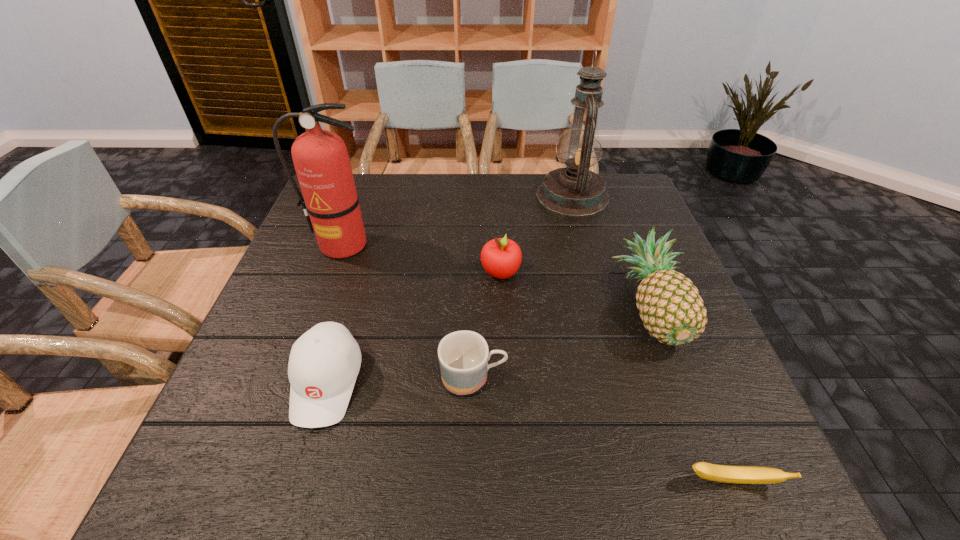
Find the location of `banana that is positioned at the right edge`. banana that is positioned at the right edge is located at coordinates (721, 473).

Identify the location of object that is positioned at the far right corner. This screenshot has height=540, width=960. (575, 191).

Locate an element on the screen. This screenshot has width=960, height=540. object that is at the near right corner is located at coordinates (721, 473).

The width and height of the screenshot is (960, 540). Identify the location of vacant space at the far edge of the desktop. (406, 179).

Find the location of `free space at the near edge of the desktop`. free space at the near edge of the desktop is located at coordinates (540, 496).

This screenshot has width=960, height=540. What are the coordinates of `free point at the left edge` in the screenshot? It's located at (238, 407).

The image size is (960, 540). I want to click on free space at the near left corner, so click(x=220, y=460).

Find the location of `free region at the near right corner of the desktop`. free region at the near right corner of the desktop is located at coordinates (707, 490).

Locate an element on the screen. This screenshot has width=960, height=540. unoccupied area between the fire extinguisher and the apple is located at coordinates (421, 259).

The width and height of the screenshot is (960, 540). In order to click on vacant point located between the pineapple and the baseball cap in this screenshot , I will do (489, 345).